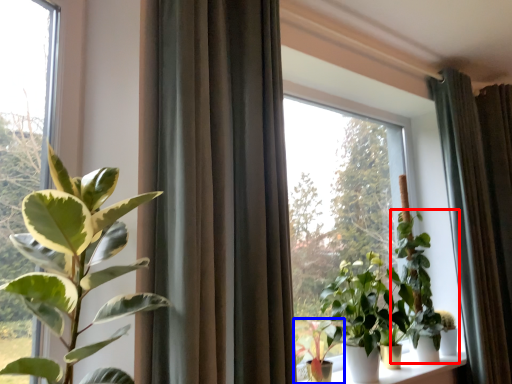
Question: Which object appears farthest to the camera in this image, houseplant (highlighted by a red box) or houseplant (highlighted by a blue box)?

Choices:
 (A) houseplant
 (B) houseplant

Answer: (A)